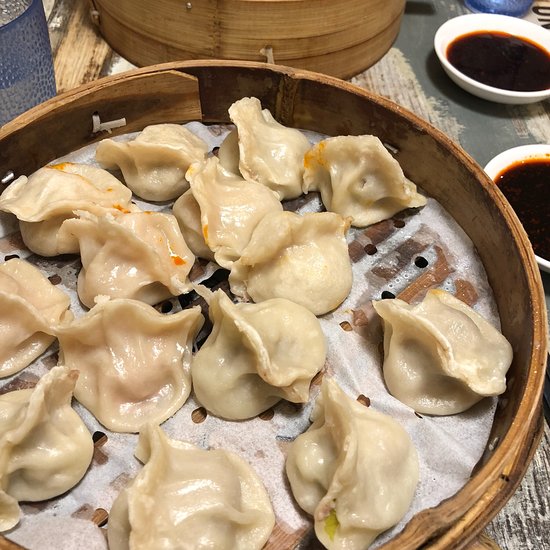
This screenshot has height=550, width=550. I want to click on bowl, so click(x=437, y=49).